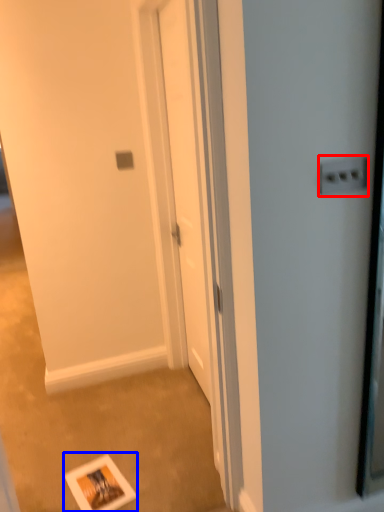
Question: Among these objects, which one is nearest to the camera, electric outlet (highlighted by a red box) or postcard (highlighted by a blue box)?

Choices:
 (A) electric outlet
 (B) postcard

Answer: (A)